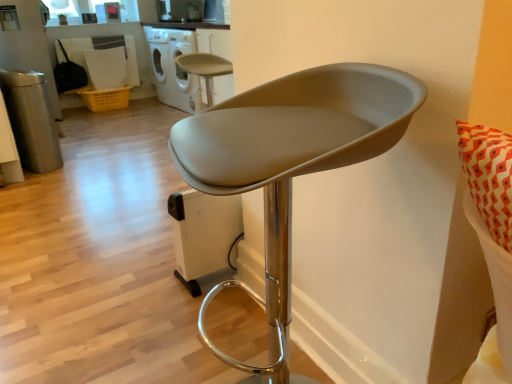
Locate an element on the screen. matte gray stool at center, which is counted as the 2th chair, starting from the bottom is located at coordinates (205, 68).

Identify the location of dish washer located behind the matte gray stool at center, placed as the 1th chair when sorted from right to left. (172, 66).

From a real-world perspective, is white glossy dishwasher at upper center physically below matte gray stool at center, the 1th chair from the front?

Actually, white glossy dishwasher at upper center is physically above matte gray stool at center, the 1th chair from the front, in the real world.

From the image's perspective, would you say white glossy dishwasher at upper center is shown under matte gray stool at center, the second chair from the back?

Incorrect, from the image's perspective, white glossy dishwasher at upper center is higher than matte gray stool at center, the second chair from the back.

In the scene shown: Is the depth of white glossy dishwasher at upper center greater than that of matte gray stool at center, placed as the 1th chair when sorted from right to left?

Yes, white glossy dishwasher at upper center is behind matte gray stool at center, placed as the 1th chair when sorted from right to left.

Between point (158, 45) and point (209, 65), which one is positioned behind?

The point (158, 45) is more distant.

The width and height of the screenshot is (512, 384). I want to click on dish washer behind the matte gray stool at center, which is the first chair from back to front, so click(172, 66).

Can you confirm if white glossy dishwasher at upper center is taller than matte gray stool at center, which is counted as the first chair, starting from the left?

Yes.

Based on the photo, from the image's perspective, between white glossy dishwasher at upper center and matte gray stool at center, which is the first chair from back to front, who is located below?

matte gray stool at center, which is the first chair from back to front.

Considering the sizes of objects matte gray stool at center, which is the 2th chair in left-to-right order, and matte gray stool at center, which is counted as the first chair, starting from the left, in the image provided, who is bigger, matte gray stool at center, which is the 2th chair in left-to-right order, or matte gray stool at center, which is counted as the first chair, starting from the left,?

With larger size is matte gray stool at center, which is the 2th chair in left-to-right order.

In the scene shown: Is matte gray stool at center, which is counted as the first chair, starting from the left, at the back of matte gray stool at center, the 1th chair from the front?

No.

Considering their positions, is matte gray stool at center, which is the 2th chair in left-to-right order, located in front of or behind matte gray stool at center, which is counted as the first chair, starting from the left?

matte gray stool at center, which is the 2th chair in left-to-right order, is positioned closer to the viewer than matte gray stool at center, which is counted as the first chair, starting from the left.

Can you confirm if matte gray stool at center, placed as the 1th chair when sorted from right to left, is taller than matte gray stool at center, the 2th chair viewed from the front?

Correct, matte gray stool at center, placed as the 1th chair when sorted from right to left, is much taller as matte gray stool at center, the 2th chair viewed from the front.

Where is `chair behind the matte gray stool at center, the 1th chair from the front`? This screenshot has width=512, height=384. chair behind the matte gray stool at center, the 1th chair from the front is located at coordinates (205, 68).

From the image's perspective, is matte gray stool at center, which is counted as the first chair, starting from the left, on matte gray stool at center, placed as the 1th chair when sorted from right to left?

Yes, from the image's perspective, matte gray stool at center, which is counted as the first chair, starting from the left, is above matte gray stool at center, placed as the 1th chair when sorted from right to left.

Is matte gray stool at center, which is counted as the 2th chair, starting from the bottom, located outside matte gray stool at center, placed as the 1th chair when sorted from right to left?

matte gray stool at center, which is counted as the 2th chair, starting from the bottom, lies outside matte gray stool at center, placed as the 1th chair when sorted from right to left,'s area.

Identify the location of dish washer located behind the matte gray stool at center, the second chair from the back. (172, 66).

Considering the relative sizes of matte gray stool at center, which is the 2th chair from top to bottom, and white glossy dishwasher at upper center in the image provided, is matte gray stool at center, which is the 2th chair from top to bottom, bigger than white glossy dishwasher at upper center?

No.

From a real-world perspective, is matte gray stool at center, the second chair from the back, positioned above or below white glossy dishwasher at upper center?

Clearly, from a real-world perspective, matte gray stool at center, the second chair from the back, is below white glossy dishwasher at upper center.

From a real-world perspective, between matte gray stool at center, which is the first chair from back to front, and white glossy dishwasher at upper center, who is vertically higher?

In real-world perspective, white glossy dishwasher at upper center is above.

Would you say matte gray stool at center, placed as the 2th chair when sorted from right to left, contains white glossy dishwasher at upper center?

No.

What are the coordinates of `chair that is the 2nd object directly below the white glossy dishwasher at upper center (from a real-world perspective)` in the screenshot? It's located at (205, 68).

Considering the positions of objects matte gray stool at center, which is the 1th chair in top-to-bottom order, and white glossy dishwasher at upper center in the image provided, who is more to the left, matte gray stool at center, which is the 1th chair in top-to-bottom order, or white glossy dishwasher at upper center?

white glossy dishwasher at upper center.

The image size is (512, 384). Find the location of `dish washer located above the matte gray stool at center, which is the 2th chair from top to bottom (from a real-world perspective)`. dish washer located above the matte gray stool at center, which is the 2th chair from top to bottom (from a real-world perspective) is located at coordinates (172, 66).

I want to click on chair that is the 1st object to the right of the white glossy dishwasher at upper center, starting at the anchor, so click(205, 68).

Estimate the real-world distances between objects in this image. Which object is closer to matte gray stool at center, placed as the 2th chair when sorted from right to left, white glossy dishwasher at upper center or matte gray stool at center, the 1th chair when ordered from bottom to top?

Among the two, white glossy dishwasher at upper center is located nearer to matte gray stool at center, placed as the 2th chair when sorted from right to left.

Which object lies nearer to the anchor point matte gray stool at center, placed as the 1th chair when sorted from right to left, white glossy dishwasher at upper center or matte gray stool at center, placed as the 2th chair when sorted from right to left?

matte gray stool at center, placed as the 2th chair when sorted from right to left.

When comparing their distances from matte gray stool at center, the second chair from the back, does matte gray stool at center, the 2th chair viewed from the front, or white glossy dishwasher at upper center seem further?

white glossy dishwasher at upper center is further to matte gray stool at center, the second chair from the back.

Considering their positions, is matte gray stool at center, the 1th chair from the front, positioned closer to matte gray stool at center, placed as the 2th chair when sorted from right to left, than white glossy dishwasher at upper center?

white glossy dishwasher at upper center is positioned closer to the anchor matte gray stool at center, placed as the 2th chair when sorted from right to left.

From the image, which object appears to be nearer to white glossy dishwasher at upper center, matte gray stool at center, which is the 2th chair in left-to-right order, or matte gray stool at center, the 2th chair viewed from the front?

Based on the image, matte gray stool at center, the 2th chair viewed from the front, appears to be nearer to white glossy dishwasher at upper center.

Which object lies further to the anchor point white glossy dishwasher at upper center, matte gray stool at center, which is counted as the 2th chair, starting from the bottom, or matte gray stool at center, which is the 2th chair from top to bottom?

matte gray stool at center, which is the 2th chair from top to bottom, is further to white glossy dishwasher at upper center.

The image size is (512, 384). Find the location of `chair between matte gray stool at center, which is the 2th chair from top to bottom, and white glossy dishwasher at upper center from front to back`. chair between matte gray stool at center, which is the 2th chair from top to bottom, and white glossy dishwasher at upper center from front to back is located at coordinates (205, 68).